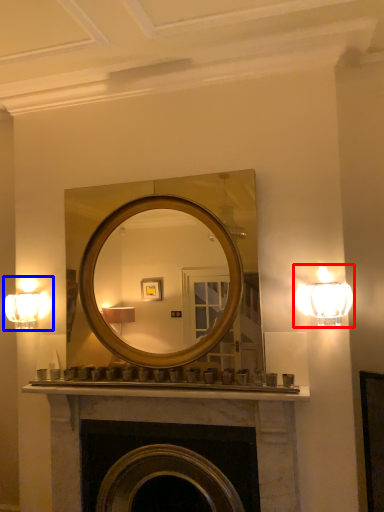
Question: Which of the following is the closest to the observer, lamp (highlighted by a red box) or fixture (highlighted by a blue box)?

Choices:
 (A) lamp
 (B) fixture

Answer: (A)